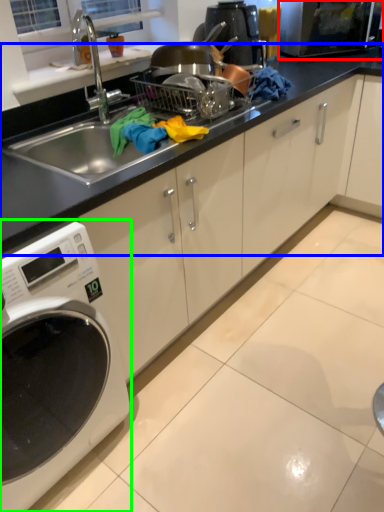
Question: Based on their relative distances, which object is nearer to microwave oven (highlighted by a red box)? Choose from countertop (highlighted by a blue box) and home appliance (highlighted by a green box).

Choices:
 (A) countertop
 (B) home appliance

Answer: (A)